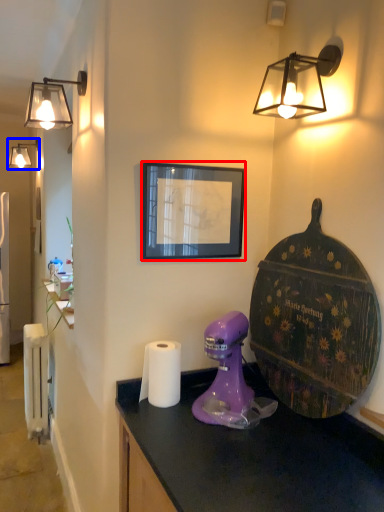
Question: Which object appears closest to the camera in this image, picture frame (highlighted by a red box) or lamp (highlighted by a blue box)?

Choices:
 (A) picture frame
 (B) lamp

Answer: (A)